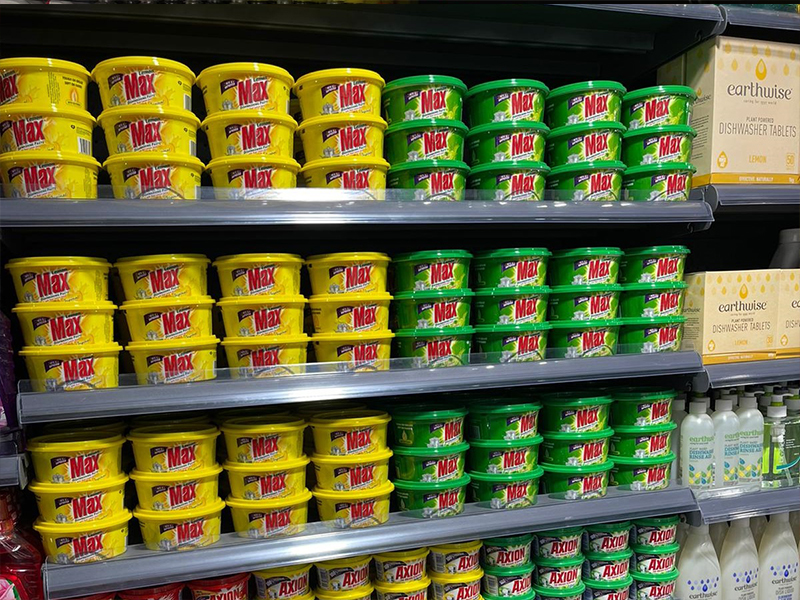
Image resolution: width=800 pixels, height=600 pixels. I want to click on shelf, so click(424, 527), click(484, 201).